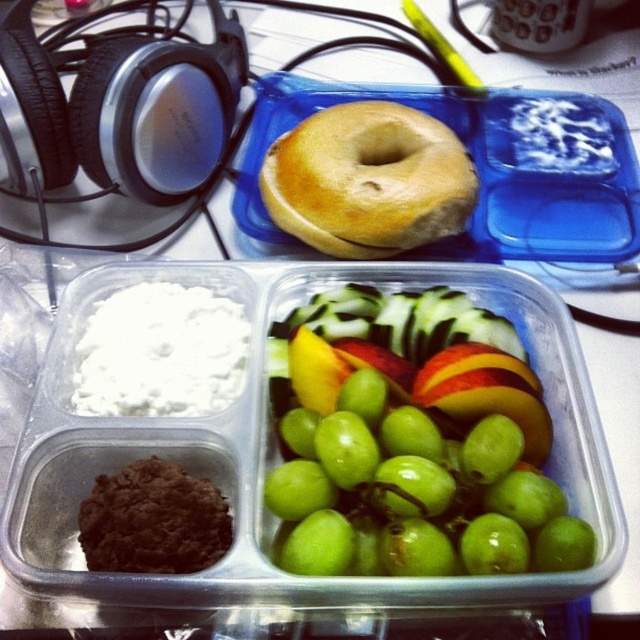
Does point (353, 442) come closer to viewer compared to point (429, 205)?

Yes, it is.

The width and height of the screenshot is (640, 640). What are the coordinates of `green matte grapes at center` in the screenshot? It's located at (413, 493).

Which is in front, point (452, 548) or point (349, 177)?

Positioned in front is point (452, 548).

At what (x,y) coordinates should I click in order to perform the action: click on green matte grapes at center. Please return your answer as a coordinate pair (x, y). Image resolution: width=640 pixels, height=640 pixels. Looking at the image, I should click on (413, 493).